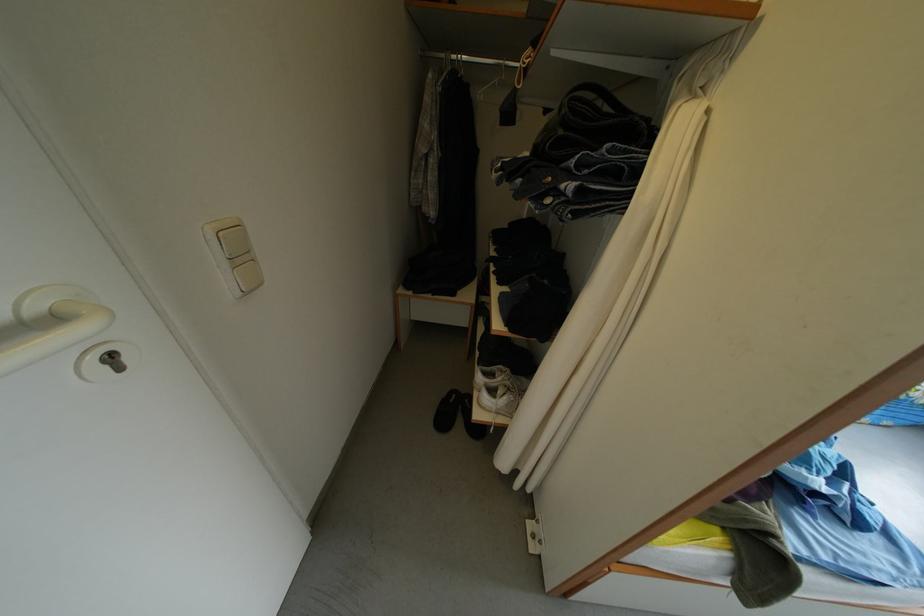
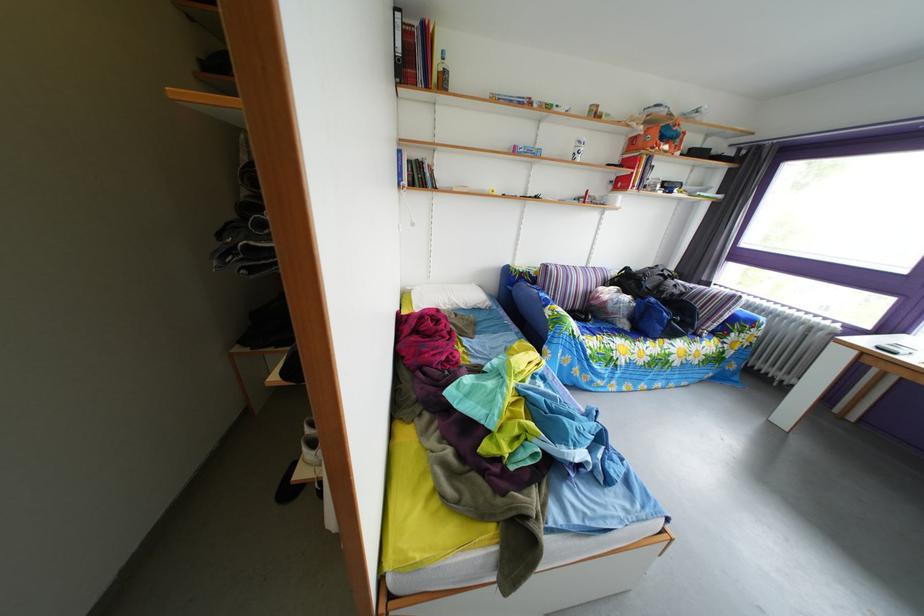
Question: How did the camera likely rotate?

Choices:
 (A) Left
 (B) Right
 (C) Up
 (D) Down

Answer: (B)